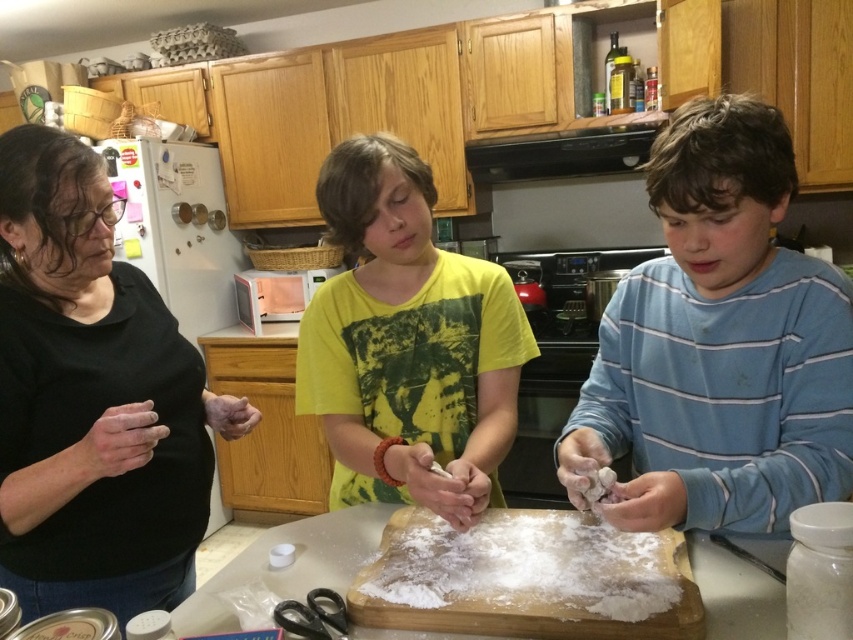
Question: Observing the image, what is the correct spatial positioning of blue striped sweater at center in reference to white powdery flour at center?

Choices:
 (A) right
 (B) left

Answer: (A)

Question: Estimate the real-world distances between objects in this image. Which object is closer to the black plastic scissors at lower center?

Choices:
 (A) yellow cotton shirt at center
 (B) blue striped sweater at center

Answer: (A)

Question: Is yellow cotton shirt at center bigger than black plastic scissors at lower center?

Choices:
 (A) yes
 (B) no

Answer: (A)

Question: Among these objects, which one is nearest to the camera?

Choices:
 (A) black plastic scissors at lower center
 (B) blue striped sweater at center
 (C) white powdery flour at center

Answer: (C)

Question: Does blue striped sweater at center have a smaller size compared to black matte shirt at left?

Choices:
 (A) yes
 (B) no

Answer: (A)

Question: Estimate the real-world distances between objects in this image. Which object is closer to the white powdery flour at center?

Choices:
 (A) black plastic scissors at lower center
 (B) yellow cotton shirt at center
 (C) blue striped sweater at center

Answer: (B)